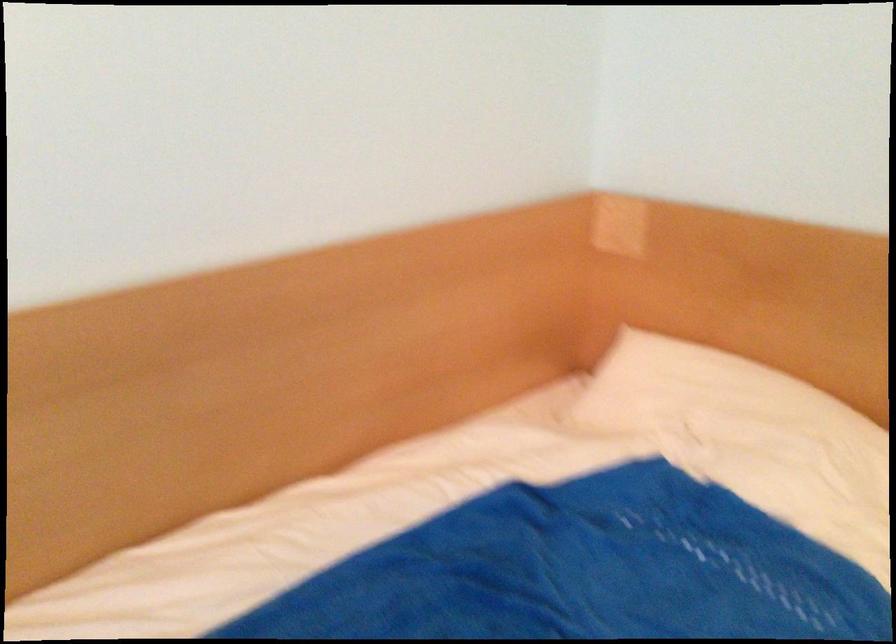
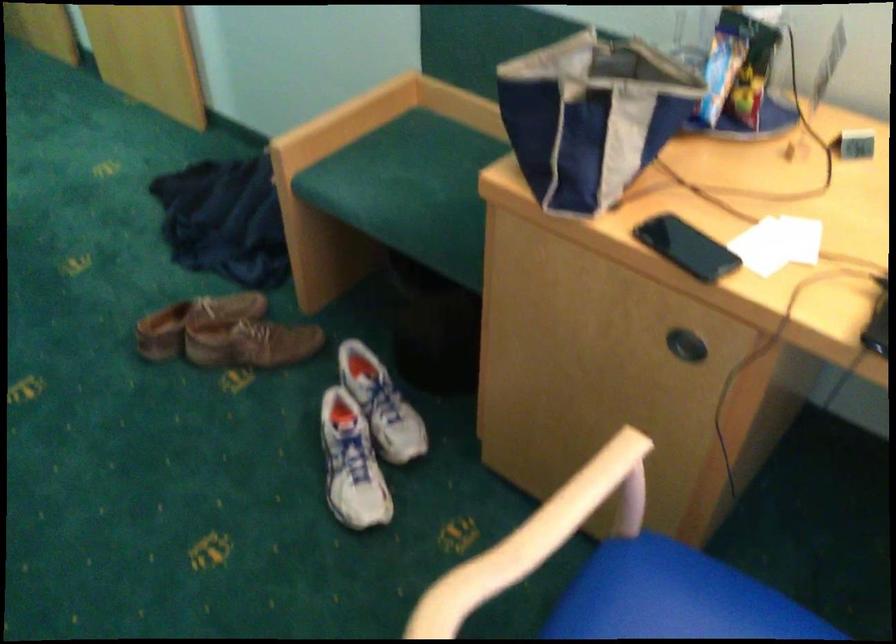
First-person continuous shooting, in which direction is the camera rotating?

The camera's rotation is toward right-down.